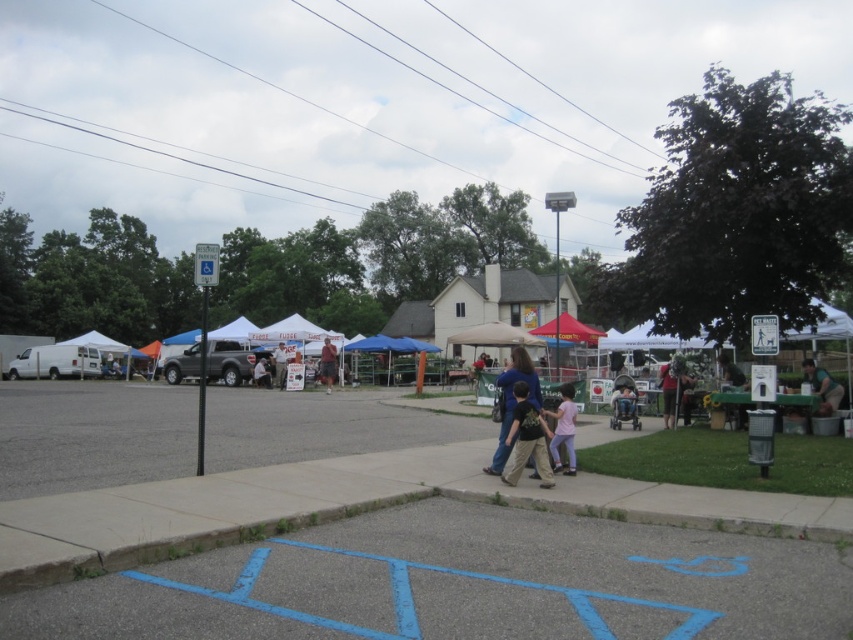
Can you confirm if blue painted asphalt at lower center is smaller than matte green shirt at center?

Actually, blue painted asphalt at lower center might be larger than matte green shirt at center.

Is blue painted asphalt at lower center in front of matte green shirt at center?

Yes.

Who is more distant from viewer, (509, 609) or (677, 387)?

Point (677, 387)

Where is `blue painted asphalt at lower center`? This screenshot has width=853, height=640. blue painted asphalt at lower center is located at coordinates (462, 584).

Is pink cotton shirt at center thinner than khaki cotton shorts at center?

Incorrect, pink cotton shirt at center's width is not less than khaki cotton shorts at center's.

Is pink cotton shirt at center positioned in front of khaki cotton shorts at center?

Yes, pink cotton shirt at center is in front of khaki cotton shorts at center.

Between point (566, 413) and point (328, 349), which one is positioned behind?

Positioned behind is point (328, 349).

Image resolution: width=853 pixels, height=640 pixels. Find the location of `pink cotton shirt at center`. pink cotton shirt at center is located at coordinates (563, 429).

Is point (503, 512) positioned in front of point (560, 429)?

Yes.

Does blue painted asphalt at lower center come behind pink cotton shirt at center?

No, it is not.

The height and width of the screenshot is (640, 853). What do you see at coordinates (462, 584) in the screenshot?
I see `blue painted asphalt at lower center` at bounding box center [462, 584].

The width and height of the screenshot is (853, 640). Identify the location of blue painted asphalt at lower center. (462, 584).